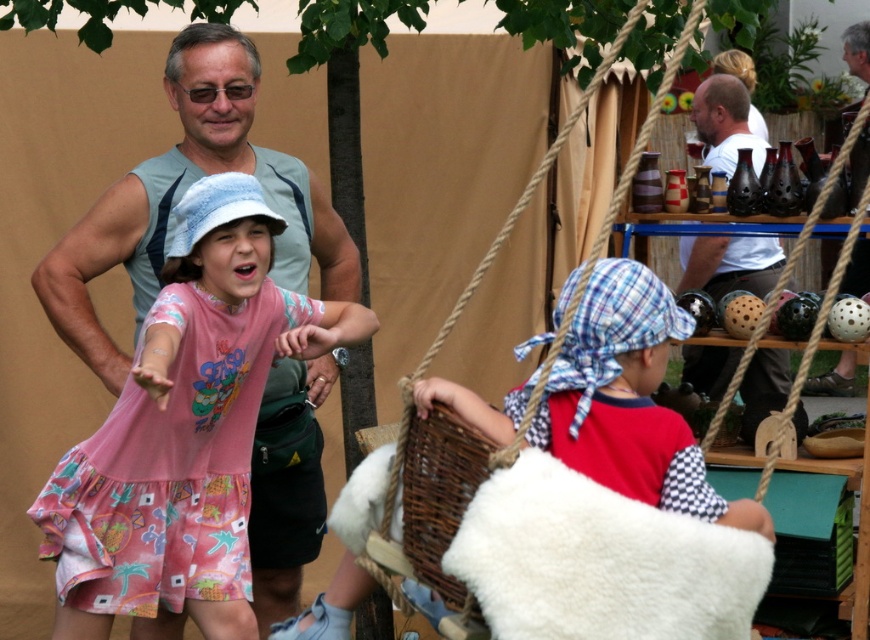
Does point (98, 532) come behind point (761, 378)?

No, (98, 532) is closer to viewer.

Which of these two, pink cotton dress at center or white cotton shirt at upper right, stands taller?

Standing taller between the two is pink cotton dress at center.

Is point (199, 221) closer to viewer compared to point (760, 387)?

Yes.

I want to click on pink cotton dress at center, so tap(185, 428).

Does plaid fabric headscarf at center appear on the right side of woven brown basket at lower center?

Correct, you'll find plaid fabric headscarf at center to the right of woven brown basket at lower center.

Which is above, plaid fabric headscarf at center or woven brown basket at lower center?

plaid fabric headscarf at center is above.

Where is `plaid fabric headscarf at center`? The height and width of the screenshot is (640, 870). plaid fabric headscarf at center is located at coordinates (628, 401).

Locate an element on the screen. The image size is (870, 640). plaid fabric headscarf at center is located at coordinates (628, 401).

Can you confirm if plaid fabric headscarf at center is taller than white cotton shirt at upper right?

Incorrect, plaid fabric headscarf at center's height is not larger of white cotton shirt at upper right's.

Does plaid fabric headscarf at center appear under white cotton shirt at upper right?

Indeed, plaid fabric headscarf at center is positioned under white cotton shirt at upper right.

Who is more forward, (637, 356) or (734, 349)?

Point (637, 356)

This screenshot has width=870, height=640. Identify the location of plaid fabric headscarf at center. (628, 401).